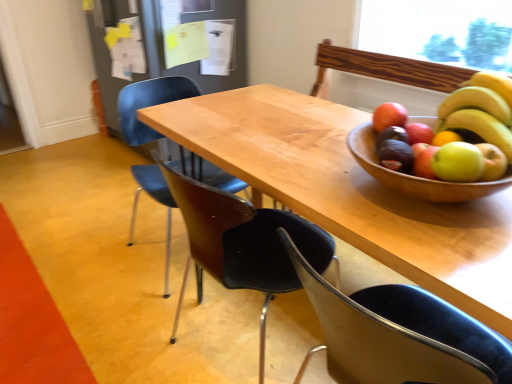
Identify the location of yellow matte bananas at upper right. This screenshot has height=384, width=512. (481, 110).

Identify the location of natural wood table at center. Image resolution: width=512 pixels, height=384 pixels. (350, 192).

What do you see at coordinates (350, 192) in the screenshot? The height and width of the screenshot is (384, 512). I see `natural wood table at center` at bounding box center [350, 192].

This screenshot has width=512, height=384. I want to click on green matte avocado at right, the 2th avocado in the front-to-back sequence, so click(392, 135).

Identify the location of yellow matte bananas at upper right. The image size is (512, 384). point(481,110).

Which is behind, point (467, 105) or point (347, 180)?

Positioned behind is point (347, 180).

From the image's perspective, is yellow matte bananas at upper right below natural wood table at center?

Incorrect, from the image's perspective, yellow matte bananas at upper right is higher than natural wood table at center.

Which object is closer to the camera taking this photo, yellow matte bananas at upper right or natural wood table at center?

natural wood table at center.

Considering the positions of points (392, 143) and (397, 138), is point (392, 143) closer to camera compared to point (397, 138)?

Yes, it is.

Which is more to the left, matte black avocado at right, which appears as the 2th avocado when viewed from the back, or green matte avocado at right, the 1th avocado when ordered from back to front?

Positioned to the left is matte black avocado at right, which appears as the 2th avocado when viewed from the back.

Considering the relative sizes of matte black avocado at right, which is the first avocado from front to back, and green matte avocado at right, the 2th avocado in the front-to-back sequence, in the image provided, is matte black avocado at right, which is the first avocado from front to back, shorter than green matte avocado at right, the 2th avocado in the front-to-back sequence,?

In fact, matte black avocado at right, which is the first avocado from front to back, may be taller than green matte avocado at right, the 2th avocado in the front-to-back sequence.

Is matte black avocado at right, which is the first avocado from front to back, located outside green matte avocado at right, the 1th avocado when ordered from back to front?

Yes.

In terms of size, does green matte avocado at right, the 2th avocado in the front-to-back sequence, appear bigger or smaller than yellow matte bananas at upper right?

Considering their sizes, green matte avocado at right, the 2th avocado in the front-to-back sequence, takes up less space than yellow matte bananas at upper right.

Is green matte avocado at right, the 1th avocado when ordered from back to front, positioned with its back to yellow matte bananas at upper right?

green matte avocado at right, the 1th avocado when ordered from back to front, does not have its back to yellow matte bananas at upper right.

Is green matte avocado at right, the 2th avocado in the front-to-back sequence, to the left of yellow matte bananas at upper right from the viewer's perspective?

Correct, you'll find green matte avocado at right, the 2th avocado in the front-to-back sequence, to the left of yellow matte bananas at upper right.

Is point (407, 141) less distant than point (485, 101)?

No, it is behind (485, 101).

Does yellow matte bananas at upper right have a greater height compared to matte black avocado at right, which appears as the 2th avocado when viewed from the back?

Yes, yellow matte bananas at upper right is taller than matte black avocado at right, which appears as the 2th avocado when viewed from the back.

From a real-world perspective, is yellow matte bananas at upper right on top of matte black avocado at right, which appears as the 2th avocado when viewed from the back?

Indeed, from a real-world perspective, yellow matte bananas at upper right stands above matte black avocado at right, which appears as the 2th avocado when viewed from the back.

Is matte black avocado at right, which appears as the 2th avocado when viewed from the back, located within yellow matte bananas at upper right?

Definitely not — matte black avocado at right, which appears as the 2th avocado when viewed from the back, is not inside yellow matte bananas at upper right.

The height and width of the screenshot is (384, 512). What are the coordinates of `banana lying above the matte black avocado at right, which is the first avocado from front to back (from the image's perspective)` in the screenshot? It's located at (481, 110).

Is yellow matte bananas at upper right oriented away from brown leather chair at center, which appears as the second chair when viewed from the front?

No, brown leather chair at center, which appears as the second chair when viewed from the front, is not at the back of yellow matte bananas at upper right.

Is point (490, 110) closer to camera compared to point (269, 252)?

That is True.

From a real-world perspective, between yellow matte bananas at upper right and brown leather chair at center, the second chair viewed from the back, who is vertically higher?

In real-world perspective, yellow matte bananas at upper right is above.

Is natural wood table at center at the back of green matte avocado at right, the 1th avocado when ordered from back to front?

green matte avocado at right, the 1th avocado when ordered from back to front, is not turned away from natural wood table at center.

Between green matte avocado at right, the 1th avocado when ordered from back to front, and natural wood table at center, which one is positioned in front?

natural wood table at center is closer to the camera.

Based on the photo, is green matte avocado at right, the 2th avocado in the front-to-back sequence, to the right of natural wood table at center from the viewer's perspective?

Yes.

From the image's perspective, is green matte avocado at right, the 2th avocado in the front-to-back sequence, beneath natural wood table at center?

No.

Is yellow matte bananas at upper right facing away from matte black chair at center, arranged as the 1th chair when viewed from the back?

No, yellow matte bananas at upper right is not facing the opposite direction of matte black chair at center, arranged as the 1th chair when viewed from the back.

From the image's perspective, is yellow matte bananas at upper right over matte black chair at center, positioned as the third chair in front-to-back order?

Indeed, from the image's perspective, yellow matte bananas at upper right is shown above matte black chair at center, positioned as the third chair in front-to-back order.

Which of these two, yellow matte bananas at upper right or matte black chair at center, positioned as the third chair in front-to-back order, stands taller?

With more height is matte black chair at center, positioned as the third chair in front-to-back order.

The width and height of the screenshot is (512, 384). What are the coordinates of `banana above the natural wood table at center (from a real-world perspective)` in the screenshot? It's located at (481, 110).

Identify the location of avocado that appears in front of the green matte avocado at right, the 1th avocado when ordered from back to front. point(395,155).

Which object lies nearer to the anchor point matte black avocado at right, which appears as the 2th avocado when viewed from the back, natural wood table at center or matte black chair at center, positioned as the third chair in front-to-back order?

The object closer to matte black avocado at right, which appears as the 2th avocado when viewed from the back, is natural wood table at center.

Estimate the real-world distances between objects in this image. Which object is closer to matte black chair at center, arranged as the 1th chair when viewed from the back, brown leather chair at center, which appears as the second chair when viewed from the front, or yellow matte bananas at upper right?

brown leather chair at center, which appears as the second chair when viewed from the front.

Based on the photo, based on their spatial positions, is matte black avocado at right, which is the first avocado from front to back, or matte black chair at center, arranged as the 1th chair when viewed from the back, closer to yellow matte bananas at upper right?

Among the two, matte black avocado at right, which is the first avocado from front to back, is located nearer to yellow matte bananas at upper right.

Based on the photo, when comparing their distances from black plastic chair at lower right, which is the third chair in back-to-front order, does natural wood table at center or brown leather chair at center, which appears as the second chair when viewed from the front, seem further?

natural wood table at center lies further to black plastic chair at lower right, which is the third chair in back-to-front order, than the other object.

Considering their positions, is brown leather chair at center, which appears as the second chair when viewed from the front, positioned closer to black plastic chair at lower right, placed as the first chair when sorted from front to back, than matte black chair at center, positioned as the third chair in front-to-back order?

brown leather chair at center, which appears as the second chair when viewed from the front.

When comparing their distances from natural wood table at center, does brown leather chair at center, which appears as the second chair when viewed from the front, or green matte avocado at right, the 2th avocado in the front-to-back sequence, seem further?

Based on the image, green matte avocado at right, the 2th avocado in the front-to-back sequence, appears to be further to natural wood table at center.

When comparing their distances from yellow matte bananas at upper right, does natural wood table at center or matte black avocado at right, which appears as the 2th avocado when viewed from the back, seem closer?

matte black avocado at right, which appears as the 2th avocado when viewed from the back, is closer to yellow matte bananas at upper right.

Considering their positions, is yellow matte bananas at upper right positioned further to green matte avocado at right, the 2th avocado in the front-to-back sequence, than matte black chair at center, positioned as the third chair in front-to-back order?

Based on the image, matte black chair at center, positioned as the third chair in front-to-back order, appears to be further to green matte avocado at right, the 2th avocado in the front-to-back sequence.

At what (x,y) coordinates should I click in order to perform the action: click on table between black plastic chair at lower right, which is the third chair in back-to-front order, and matte black chair at center, positioned as the third chair in front-to-back order, along the z-axis. Please return your answer as a coordinate pair (x, y). Looking at the image, I should click on (350, 192).

This screenshot has height=384, width=512. What are the coordinates of `table situated between brown leather chair at center, which appears as the second chair when viewed from the front, and yellow matte bananas at upper right from left to right` in the screenshot? It's located at (350, 192).

At what (x,y) coordinates should I click in order to perform the action: click on chair between black plastic chair at lower right, placed as the first chair when sorted from front to back, and matte black chair at center, positioned as the third chair in front-to-back order, along the z-axis. Please return your answer as a coordinate pair (x, y). The height and width of the screenshot is (384, 512). Looking at the image, I should click on point(242,238).

Locate an element on the screen. table between black plastic chair at lower right, which is the third chair in back-to-front order, and brown leather chair at center, the second chair viewed from the back, along the z-axis is located at coordinates (350, 192).